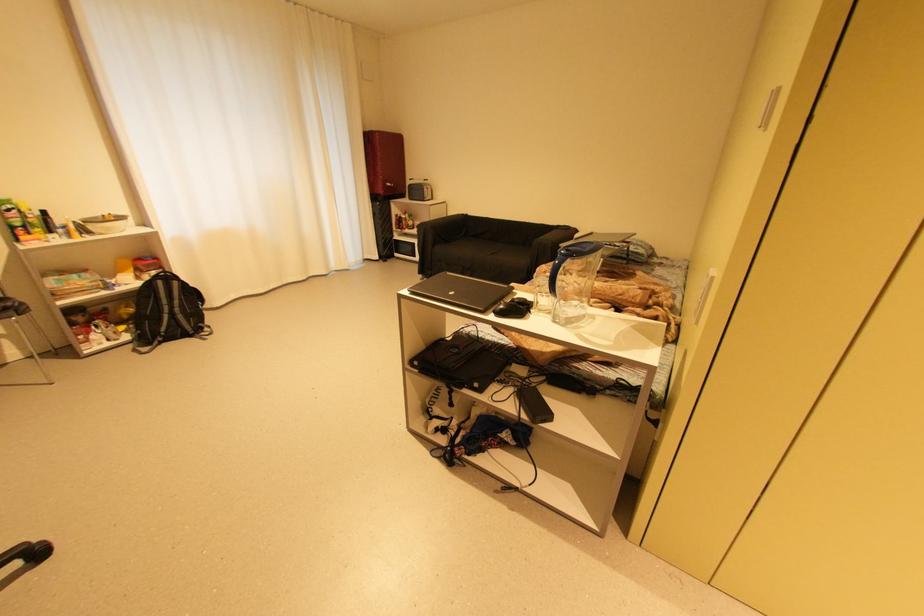
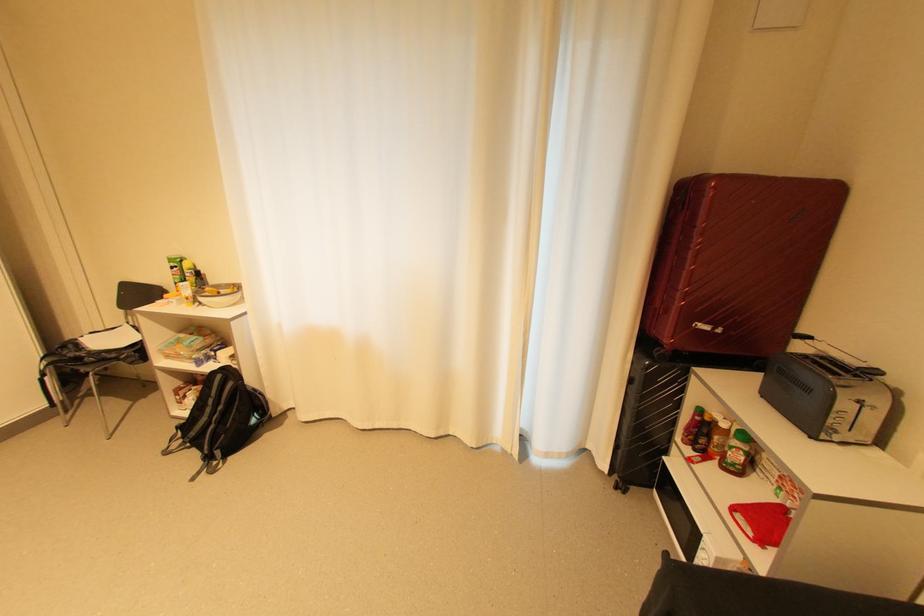
In the second image, find the point that corresponds to pixel 396 185 in the first image.

(713, 328)